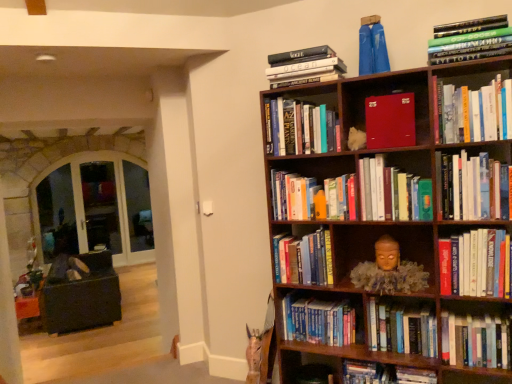
Question: Looking at their shapes, would you say hardcover books at lower right is wider or thinner than blue hardcover book at center, marked as the 2th book in a bottom-to-top arrangement?

Choices:
 (A) thin
 (B) wide

Answer: (B)

Question: In the image, is hardcover books at lower right on the left side or the right side of blue hardcover book at center, marked as the 2th book in a bottom-to-top arrangement?

Choices:
 (A) right
 (B) left

Answer: (B)

Question: Considering the real-world distances, which object is closest to the blue hardcover book at center, marked as the 2th book in a bottom-to-top arrangement?

Choices:
 (A) matte black entertainment center at left
 (B) hardcover book at lower right, placed as the fourteenth book when sorted from top to bottom
 (C) hardcover book at upper right, the 4th book in the top-to-bottom sequence
 (D) hardcover book at lower right, arranged as the twelfth book when viewed from the top
 (E) hardcover book at center, which is counted as the ninth book, starting from the top

Answer: (B)

Question: Based on their relative distances, which object is farther from the hardcover book at lower right, placed as the fourteenth book when sorted from top to bottom?

Choices:
 (A) hardcover books at upper center, the 9th book in the bottom-to-top sequence
 (B) wooden bookcase at upper right
 (C) hardcover books at center right, the eighth book when ordered from bottom to top
 (D) hardcover book at lower right, arranged as the twelfth book when viewed from the top
 (E) blue hardcover book at center, arranged as the thirteenth book when viewed from the top

Answer: (A)